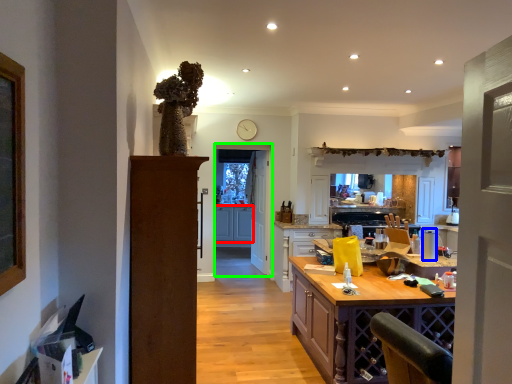
Question: Which is farther away from cabinetry (highlighted by a red box)? appliance (highlighted by a blue box) or glass door (highlighted by a green box)?

Choices:
 (A) appliance
 (B) glass door

Answer: (A)